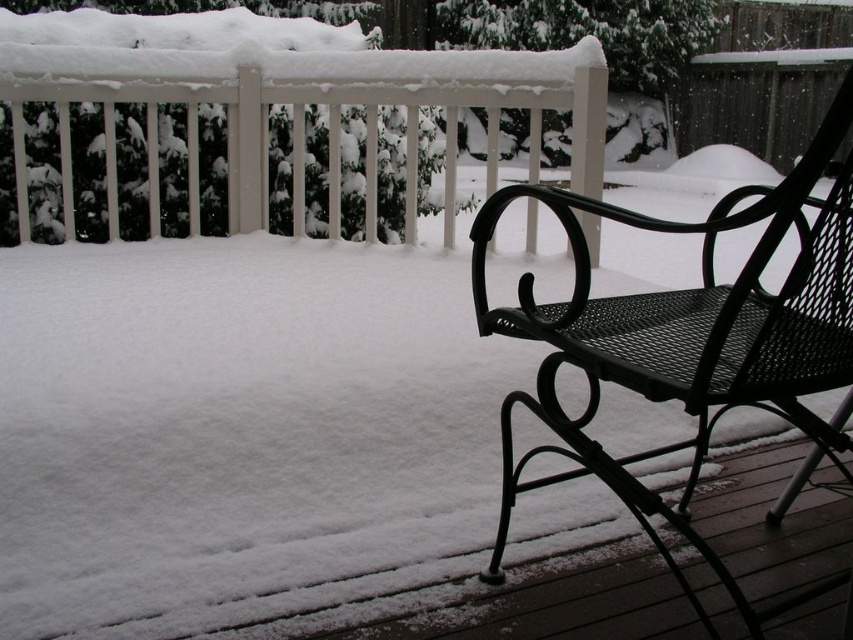
Question: Can you confirm if black mesh chair at right is smaller than white painted wood railing at upper left?

Choices:
 (A) yes
 (B) no

Answer: (A)

Question: Is black mesh chair at right to the right of white painted wood railing at upper left from the viewer's perspective?

Choices:
 (A) yes
 (B) no

Answer: (A)

Question: Is the position of black mesh chair at right more distant than that of white painted wood railing at upper left?

Choices:
 (A) no
 (B) yes

Answer: (A)

Question: Which point is closer to the camera taking this photo?

Choices:
 (A) (624, 371)
 (B) (598, 196)

Answer: (A)

Question: Which object appears farthest from the camera in this image?

Choices:
 (A) white painted wood railing at upper left
 (B) black mesh chair at right

Answer: (A)